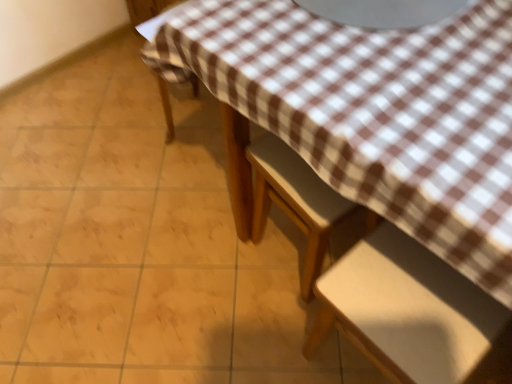
What is the approximate height of brown checkered fabric at lower left, which appears as the third chair when ordered from the bottom?

44.74 centimeters.

What do you see at coordinates (151, 14) in the screenshot? I see `brown checkered fabric at lower left, which appears as the third chair when ordered from the bottom` at bounding box center [151, 14].

The height and width of the screenshot is (384, 512). I want to click on brown checkered tablecloth at upper center, so click(x=375, y=112).

I want to click on brown checkered fabric at lower left, which appears as the third chair when ordered from the bottom, so coord(151,14).

From the picture: Can you confirm if brown checkered tablecloth at upper center is thinner than brown checkered fabric at lower left, which is the first chair in top-to-bottom order?

No.

Does brown checkered tablecloth at upper center come in front of brown checkered fabric at lower left, which is the first chair in top-to-bottom order?

Yes, brown checkered tablecloth at upper center is closer to the camera.

Is brown checkered fabric at lower left, which appears as the third chair when ordered from the bottom, located within brown checkered tablecloth at upper center?

Definitely not — brown checkered fabric at lower left, which appears as the third chair when ordered from the bottom, is not inside brown checkered tablecloth at upper center.

Which of these two, brown checkered tablecloth at upper center or brown checkered fabric at lower left, which appears as the third chair when ordered from the bottom, is smaller?

brown checkered fabric at lower left, which appears as the third chair when ordered from the bottom, is smaller.

From a real-world perspective, is brown checkered fabric at lower left, which appears as the third chair when ordered from the bottom, beneath wooden chair at center, placed as the second chair when sorted from top to bottom?

Yes, from a real-world perspective, brown checkered fabric at lower left, which appears as the third chair when ordered from the bottom, is beneath wooden chair at center, placed as the second chair when sorted from top to bottom.

Is brown checkered fabric at lower left, which is the first chair in top-to-bottom order, inside or outside of wooden chair at center, placed as the second chair when sorted from top to bottom?

brown checkered fabric at lower left, which is the first chair in top-to-bottom order, is spatially situated outside wooden chair at center, placed as the second chair when sorted from top to bottom.

Is wooden chair at center, which is the second chair in bottom-to-top order, at the back of brown checkered fabric at lower left, which appears as the third chair when ordered from the bottom?

No, brown checkered fabric at lower left, which appears as the third chair when ordered from the bottom,'s orientation is not away from wooden chair at center, which is the second chair in bottom-to-top order.

How many degrees apart are the facing directions of brown checkered fabric at lower left, which is the first chair in top-to-bottom order, and wooden chair at center, placed as the second chair when sorted from top to bottom?

The facing directions of brown checkered fabric at lower left, which is the first chair in top-to-bottom order, and wooden chair at center, placed as the second chair when sorted from top to bottom, are 44.8 degrees apart.

From a real-world perspective, between wooden chair at center, which is the second chair in bottom-to-top order, and brown checkered fabric at lower left, which appears as the third chair when ordered from the bottom, who is vertically higher?

wooden chair at center, which is the second chair in bottom-to-top order, is physically above.

Based on their sizes in the image, would you say wooden chair at center, placed as the second chair when sorted from top to bottom, is bigger or smaller than brown checkered fabric at lower left, which is the first chair in top-to-bottom order?

In the image, wooden chair at center, placed as the second chair when sorted from top to bottom, appears to be smaller than brown checkered fabric at lower left, which is the first chair in top-to-bottom order.

Considering the relative positions of wooden chair at center, placed as the second chair when sorted from top to bottom, and brown checkered fabric at lower left, which is the first chair in top-to-bottom order, in the image provided, is wooden chair at center, placed as the second chair when sorted from top to bottom, to the left of brown checkered fabric at lower left, which is the first chair in top-to-bottom order, from the viewer's perspective?

Incorrect, wooden chair at center, placed as the second chair when sorted from top to bottom, is not on the left side of brown checkered fabric at lower left, which is the first chair in top-to-bottom order.

Between point (281, 148) and point (166, 0), which one is positioned in front?

Positioned in front is point (281, 148).

Is wooden chair at center, placed as the second chair when sorted from top to bottom, at the back of brown checkered tablecloth at upper center?

That's not correct — brown checkered tablecloth at upper center is not looking away from wooden chair at center, placed as the second chair when sorted from top to bottom.

Does point (191, 15) come in front of point (308, 244)?

Yes, point (191, 15) is in front of point (308, 244).

Between brown checkered tablecloth at upper center and wooden chair at center, which is the second chair in bottom-to-top order, which one has smaller size?

wooden chair at center, which is the second chair in bottom-to-top order.

Is brown checkered tablecloth at upper center far from wooden chair at center, which is the second chair in bottom-to-top order?

No.

Are white matte chair at lower right, the first chair in the bottom-to-top sequence, and brown checkered tablecloth at upper center making contact?

white matte chair at lower right, the first chair in the bottom-to-top sequence, and brown checkered tablecloth at upper center are not in contact.

Could you tell me if white matte chair at lower right, marked as the 3th chair in a top-to-bottom arrangement, is facing brown checkered tablecloth at upper center?

No.

From the picture: Can you confirm if white matte chair at lower right, the first chair in the bottom-to-top sequence, is wider than brown checkered tablecloth at upper center?

Incorrect, the width of white matte chair at lower right, the first chair in the bottom-to-top sequence, does not surpass that of brown checkered tablecloth at upper center.

Can you tell me how much white matte chair at lower right, the first chair in the bottom-to-top sequence, and brown checkered tablecloth at upper center differ in facing direction?

The facing directions of white matte chair at lower right, the first chair in the bottom-to-top sequence, and brown checkered tablecloth at upper center are 88.6 degrees apart.

Is white matte chair at lower right, marked as the 3th chair in a top-to-bottom arrangement, oriented away from brown checkered fabric at lower left, which appears as the third chair when ordered from the bottom?

No, brown checkered fabric at lower left, which appears as the third chair when ordered from the bottom, is not at the back of white matte chair at lower right, marked as the 3th chair in a top-to-bottom arrangement.

Which object is positioned more to the right, white matte chair at lower right, marked as the 3th chair in a top-to-bottom arrangement, or brown checkered fabric at lower left, which appears as the third chair when ordered from the bottom?

white matte chair at lower right, marked as the 3th chair in a top-to-bottom arrangement.

Does point (430, 257) come behind point (138, 4)?

No, it is in front of (138, 4).

Is white matte chair at lower right, marked as the 3th chair in a top-to-bottom arrangement, in contact with brown checkered fabric at lower left, which appears as the third chair when ordered from the bottom?

No, white matte chair at lower right, marked as the 3th chair in a top-to-bottom arrangement, is not touching brown checkered fabric at lower left, which appears as the third chair when ordered from the bottom.

Who is smaller, white matte chair at lower right, marked as the 3th chair in a top-to-bottom arrangement, or wooden chair at center, which is the second chair in bottom-to-top order?

wooden chair at center, which is the second chair in bottom-to-top order, is smaller.

Is white matte chair at lower right, the first chair in the bottom-to-top sequence, not inside wooden chair at center, which is the second chair in bottom-to-top order?

Yes.

Between white matte chair at lower right, the first chair in the bottom-to-top sequence, and wooden chair at center, placed as the second chair when sorted from top to bottom, which one appears on the left side from the viewer's perspective?

Positioned to the left is wooden chair at center, placed as the second chair when sorted from top to bottom.

Looking at their sizes, would you say white matte chair at lower right, the first chair in the bottom-to-top sequence, is wider or thinner than wooden chair at center, which is the second chair in bottom-to-top order?

white matte chair at lower right, the first chair in the bottom-to-top sequence, is wider than wooden chair at center, which is the second chair in bottom-to-top order.

The height and width of the screenshot is (384, 512). In order to click on the 2nd chair above when counting from the brown checkered tablecloth at upper center (from the image's perspective) in this screenshot , I will do coord(151,14).

The width and height of the screenshot is (512, 384). I want to click on chair on the left of wooden chair at center, which is the second chair in bottom-to-top order, so click(x=151, y=14).

Looking at this image, when comparing their distances from white matte chair at lower right, the first chair in the bottom-to-top sequence, does brown checkered tablecloth at upper center or brown checkered fabric at lower left, which is the first chair in top-to-bottom order, seem further?

brown checkered fabric at lower left, which is the first chair in top-to-bottom order, is positioned further to the anchor white matte chair at lower right, the first chair in the bottom-to-top sequence.

When comparing their distances from brown checkered fabric at lower left, which appears as the third chair when ordered from the bottom, does wooden chair at center, which is the second chair in bottom-to-top order, or white matte chair at lower right, the first chair in the bottom-to-top sequence, seem closer?

Based on the image, wooden chair at center, which is the second chair in bottom-to-top order, appears to be nearer to brown checkered fabric at lower left, which appears as the third chair when ordered from the bottom.

When comparing their distances from brown checkered tablecloth at upper center, does white matte chair at lower right, marked as the 3th chair in a top-to-bottom arrangement, or brown checkered fabric at lower left, which appears as the third chair when ordered from the bottom, seem further?

brown checkered fabric at lower left, which appears as the third chair when ordered from the bottom, is positioned further to the anchor brown checkered tablecloth at upper center.

Looking at the image, which one is located closer to white matte chair at lower right, the first chair in the bottom-to-top sequence, wooden chair at center, which is the second chair in bottom-to-top order, or brown checkered tablecloth at upper center?

Based on the image, wooden chair at center, which is the second chair in bottom-to-top order, appears to be nearer to white matte chair at lower right, the first chair in the bottom-to-top sequence.

Consider the image. When comparing their distances from brown checkered fabric at lower left, which appears as the third chair when ordered from the bottom, does white matte chair at lower right, marked as the 3th chair in a top-to-bottom arrangement, or brown checkered tablecloth at upper center seem closer?

brown checkered tablecloth at upper center.

From the image, which object appears to be nearer to brown checkered fabric at lower left, which appears as the third chair when ordered from the bottom, white matte chair at lower right, the first chair in the bottom-to-top sequence, or wooden chair at center, which is the second chair in bottom-to-top order?

The object closer to brown checkered fabric at lower left, which appears as the third chair when ordered from the bottom, is wooden chair at center, which is the second chair in bottom-to-top order.

Estimate the real-world distances between objects in this image. Which object is closer to brown checkered fabric at lower left, which is the first chair in top-to-bottom order, brown checkered tablecloth at upper center or wooden chair at center, placed as the second chair when sorted from top to bottom?

brown checkered tablecloth at upper center is positioned closer to the anchor brown checkered fabric at lower left, which is the first chair in top-to-bottom order.

Which object lies further to the anchor point wooden chair at center, placed as the second chair when sorted from top to bottom, white matte chair at lower right, marked as the 3th chair in a top-to-bottom arrangement, or brown checkered fabric at lower left, which appears as the third chair when ordered from the bottom?

Among the two, brown checkered fabric at lower left, which appears as the third chair when ordered from the bottom, is located further to wooden chair at center, placed as the second chair when sorted from top to bottom.

Image resolution: width=512 pixels, height=384 pixels. What are the coordinates of `table between brown checkered fabric at lower left, which appears as the third chair when ordered from the bottom, and white matte chair at lower right, marked as the 3th chair in a top-to-bottom arrangement, in the vertical direction` in the screenshot? It's located at (375, 112).

Image resolution: width=512 pixels, height=384 pixels. In order to click on chair between brown checkered fabric at lower left, which appears as the third chair when ordered from the bottom, and white matte chair at lower right, the first chair in the bottom-to-top sequence, in the up-down direction in this screenshot , I will do `click(295, 200)`.

Where is `chair that lies between brown checkered fabric at lower left, which appears as the third chair when ordered from the bottom, and brown checkered tablecloth at upper center from top to bottom`? chair that lies between brown checkered fabric at lower left, which appears as the third chair when ordered from the bottom, and brown checkered tablecloth at upper center from top to bottom is located at coordinates (295, 200).